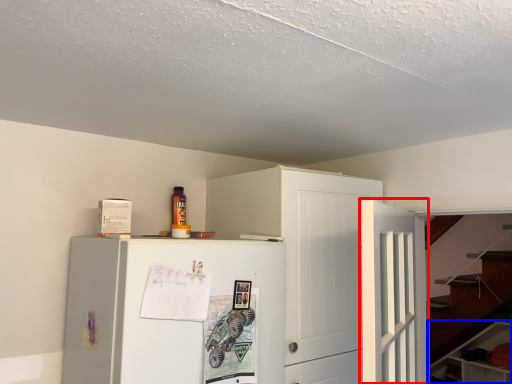
Question: Which of the following is the closest to the observer, door (highlighted by a red box) or cabinetry (highlighted by a blue box)?

Choices:
 (A) door
 (B) cabinetry

Answer: (A)